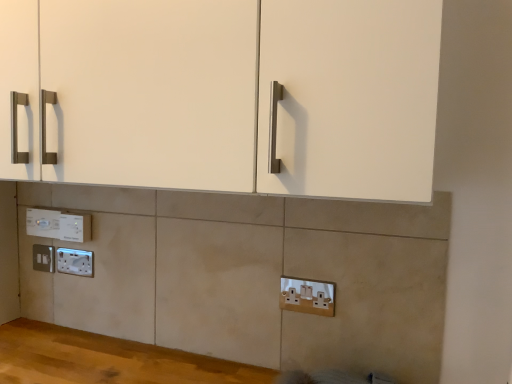
Question: From a real-world perspective, is white plastic socket at lower left, which is counted as the third electric outlet, starting from the front, physically located above or below white plastic electric outlet at lower left, which is the fourth electric outlet in back-to-front order?

Choices:
 (A) above
 (B) below

Answer: (B)

Question: In terms of size, does white plastic socket at lower left, the third electric outlet positioned from the right, appear bigger or smaller than white plastic electric outlet at lower left, which is the fourth electric outlet in back-to-front order?

Choices:
 (A) big
 (B) small

Answer: (B)

Question: Estimate the real-world distances between objects in this image. Which object is closer to the white plastic electric outlet at lower left, placed as the 4th electric outlet when sorted from front to back?

Choices:
 (A) white plastic electric outlet at lower left, which appears as the fifth electric outlet when viewed from the front
 (B) white plastic socket at lower center, which is the fifth electric outlet in back-to-front order
 (C) white plastic electric outlet at lower left, which is the fourth electric outlet in back-to-front order
 (D) white plastic socket at lower left, the third electric outlet in the back-to-front sequence

Answer: (C)

Question: Which is farther from the white plastic socket at lower left, the third electric outlet in the back-to-front sequence?

Choices:
 (A) white plastic electric outlet at lower left, the fourth electric outlet viewed from the left
 (B) white plastic electric outlet at lower left, the second electric outlet viewed from the back
 (C) white plastic electric outlet at lower left, arranged as the 1th electric outlet when viewed from the left
 (D) white plastic socket at lower center, the 1th electric outlet viewed from the right

Answer: (D)